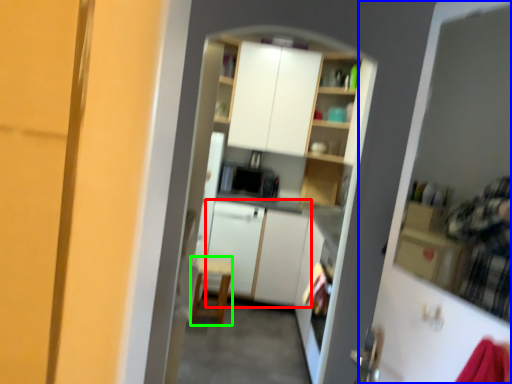
Question: Considering the real-world distances, which object is farthest from cabinetry (highlighted by a red box)? screen door (highlighted by a blue box) or chair (highlighted by a green box)?

Choices:
 (A) screen door
 (B) chair

Answer: (A)